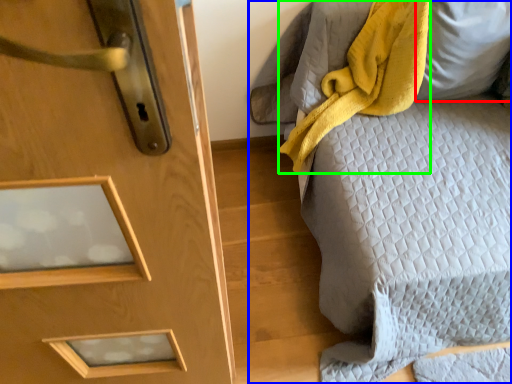
Question: Estimate the real-world distances between objects in this image. Which object is closer to pillow (highlighted by a red box), furniture (highlighted by a blue box) or blanket (highlighted by a green box)?

Choices:
 (A) furniture
 (B) blanket

Answer: (B)